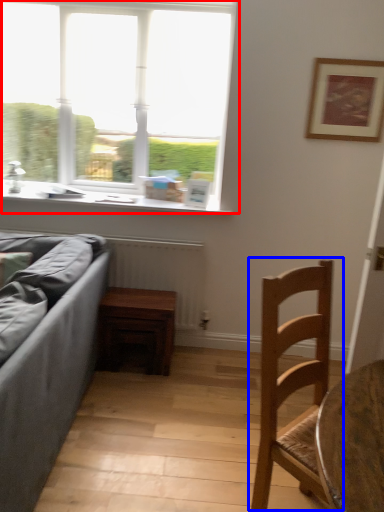
Question: Which point is further to the camera, window (highlighted by a red box) or chair (highlighted by a blue box)?

Choices:
 (A) window
 (B) chair

Answer: (A)